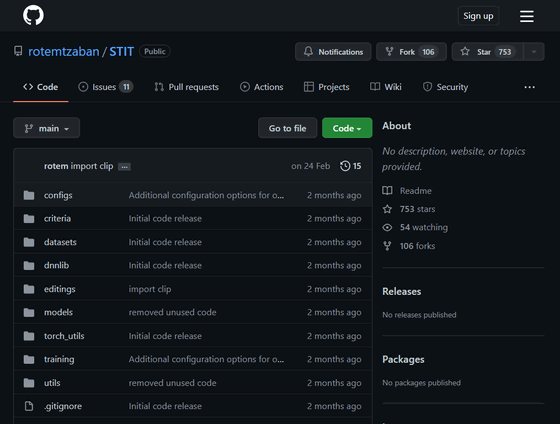
The height and width of the screenshot is (424, 560). What are the coordinates of `folder` in the screenshot? It's located at (26, 194), (30, 216), (30, 240), (24, 263), (30, 287), (26, 310), (29, 330), (29, 362), (32, 380).